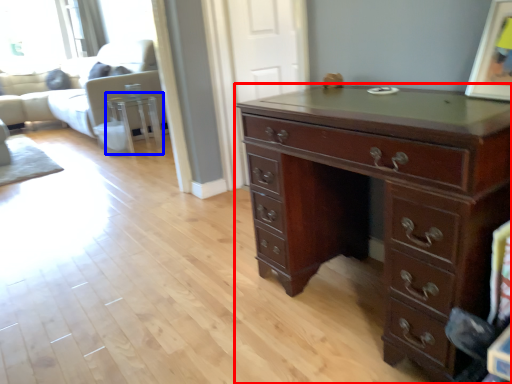
Question: Which object appears closest to the camera in this image, chest of drawers (highlighted by a red box) or side table (highlighted by a blue box)?

Choices:
 (A) chest of drawers
 (B) side table

Answer: (A)